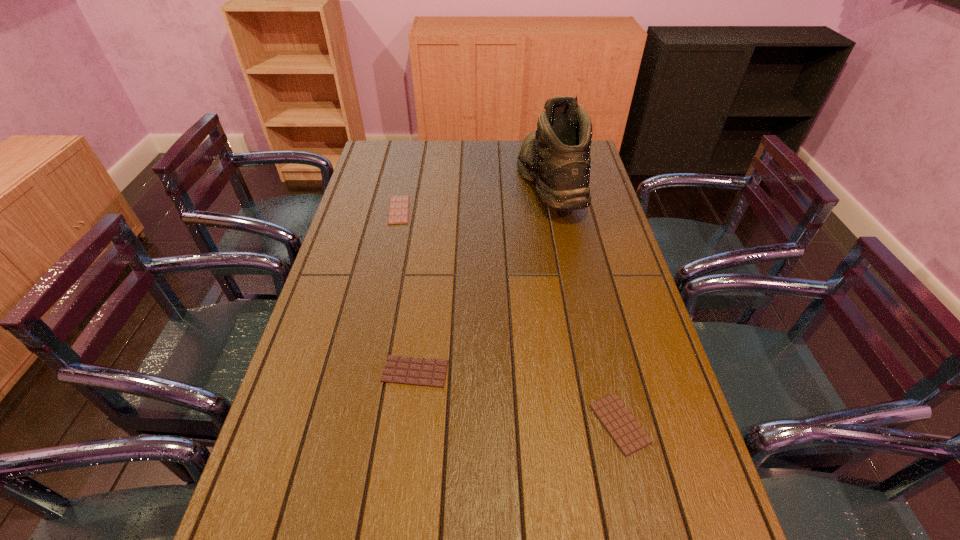
This screenshot has width=960, height=540. Identify the location of empty location between the tallest object and the leftmost object. (473, 197).

The image size is (960, 540). I want to click on vacant area between the nearest object and the second chocolate bar from left to right, so click(517, 397).

Image resolution: width=960 pixels, height=540 pixels. What are the coordinates of `free spot between the second chocolate bar from right to left and the tallest object` in the screenshot? It's located at (482, 278).

Identify the location of empty space that is in between the second tallest object and the second chocolate bar from right to left. The width and height of the screenshot is (960, 540). (517, 397).

Where is `free spot between the tallest object and the leftmost object`? Image resolution: width=960 pixels, height=540 pixels. free spot between the tallest object and the leftmost object is located at coordinates (473, 197).

The height and width of the screenshot is (540, 960). In order to click on empty space that is in between the ski boot and the third farthest object in this screenshot , I will do `click(482, 278)`.

In order to click on free spot between the leftmost chocolate bar and the third shortest object in this screenshot , I will do `click(509, 317)`.

Find the location of a particular element. free space between the ski boot and the leftmost object is located at coordinates (473, 197).

I want to click on blank region between the nearest object and the second chocolate bar from left to right, so click(517, 397).

Locate an element on the screen. object that ranks as the closest to the tallest object is located at coordinates (398, 213).